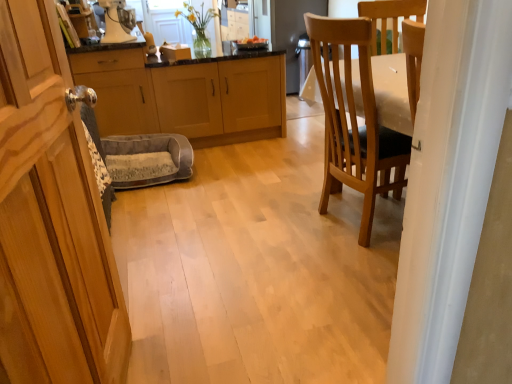
Question: Is point (53, 274) closer or farther from the camera than point (202, 139)?

Choices:
 (A) closer
 (B) farther

Answer: (A)

Question: Looking at their shapes, would you say wooden cabinet at left, which ranks as the third cabinetry in back-to-front order, is wider or thinner than light wood/finish cabinet at center, the 1th cabinetry when ordered from back to front?

Choices:
 (A) thin
 (B) wide

Answer: (A)

Question: Estimate the real-world distances between objects in this image. Which object is farther from the wooden chair at right?

Choices:
 (A) metallic silver cabinet at left, the second cabinetry viewed from the front
 (B) white glossy blender at upper center
 (C) light wood/finish cabinet at center, acting as the 3th cabinetry starting from the front
 (D) gray plush pet bed at center
 (E) wooden cabinet at left, which ranks as the third cabinetry in back-to-front order

Answer: (B)

Question: Which object is positioned farthest from the wooden chair at right?

Choices:
 (A) metallic silver cabinet at left, the second cabinetry viewed from the front
 (B) gray plush pet bed at center
 (C) wooden cabinet at left, positioned as the 1th cabinetry in front-to-back order
 (D) white glossy blender at upper center
 (E) light wood/finish cabinet at center, acting as the 3th cabinetry starting from the front

Answer: (D)